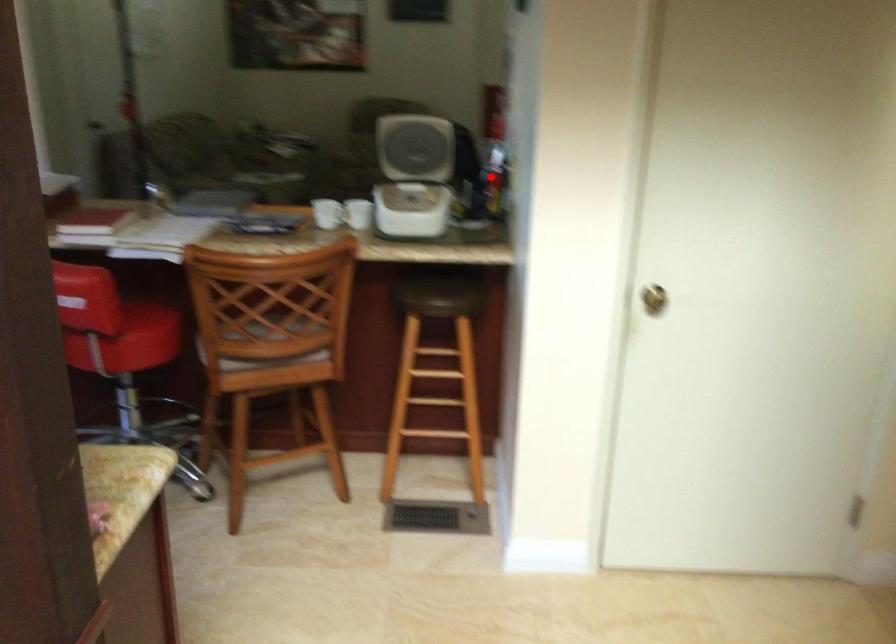
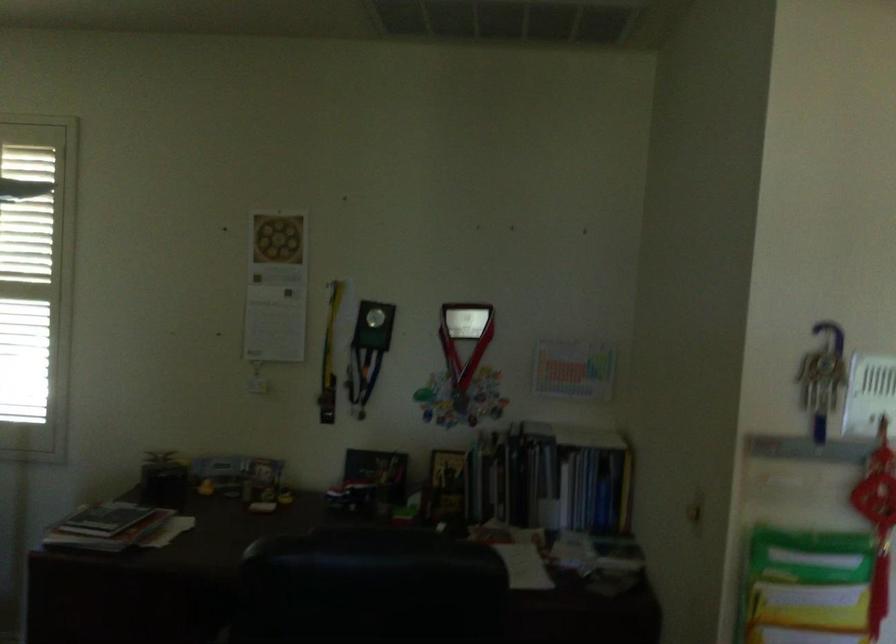
Question: I am providing you with two images of the same scene from different viewpoints. A red point is shown in image1. For the corresponding object point in image2, is it positioned nearer or farther from the camera?

Choices:
 (A) Nearer
 (B) Farther

Answer: (A)